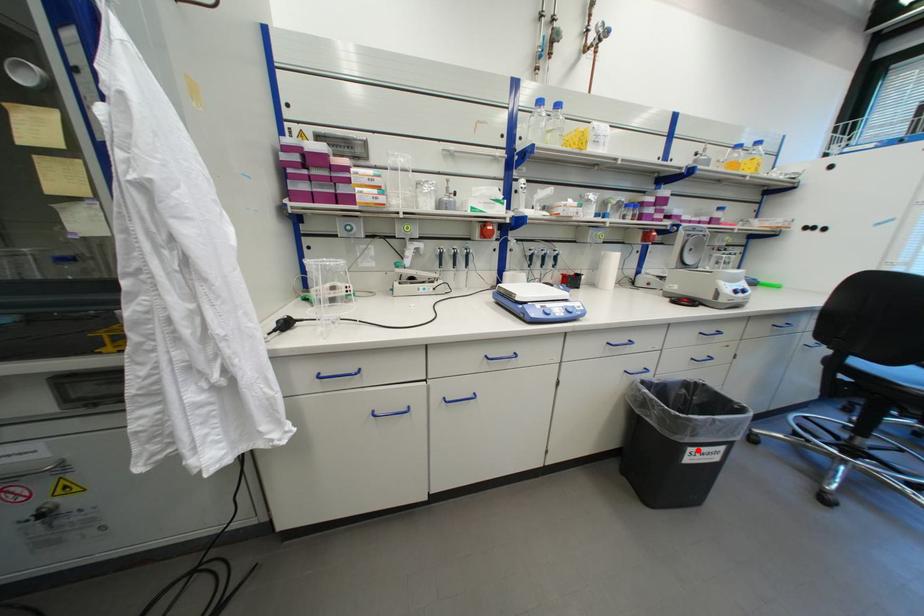
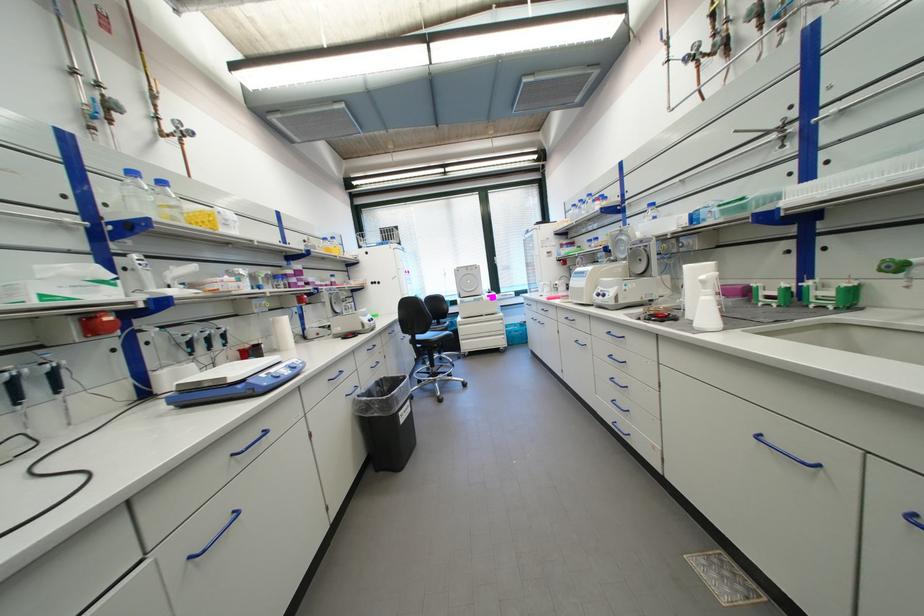
Where in the second image is the point corresponding to the highlighted location from the first image?

(407, 415)